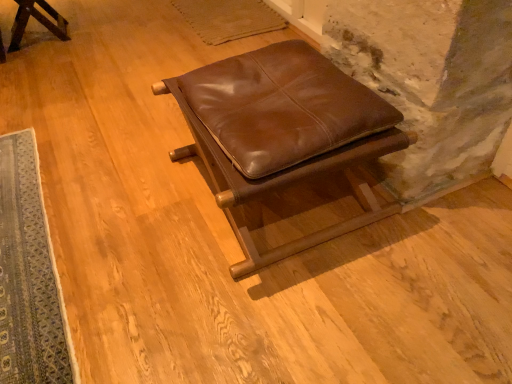
Question: Would you say blue woven rug at lower left is a long distance from brown leather ottoman at center, which ranks as the 2th furniture in back-to-front order?

Choices:
 (A) no
 (B) yes

Answer: (A)

Question: Is blue woven rug at lower left smaller than brown leather ottoman at center, arranged as the second furniture when viewed from the left?

Choices:
 (A) no
 (B) yes

Answer: (B)

Question: Can you confirm if blue woven rug at lower left is bigger than brown leather ottoman at center, which appears as the first furniture when viewed from the front?

Choices:
 (A) yes
 (B) no

Answer: (B)

Question: Is blue woven rug at lower left in contact with brown leather ottoman at center, which is the first furniture in right-to-left order?

Choices:
 (A) yes
 (B) no

Answer: (B)

Question: Considering the relative sizes of blue woven rug at lower left and brown leather ottoman at center, which appears as the first furniture when viewed from the front, in the image provided, is blue woven rug at lower left taller than brown leather ottoman at center, which appears as the first furniture when viewed from the front,?

Choices:
 (A) no
 (B) yes

Answer: (A)

Question: In the image, is brown leather ottoman at center, which is the first furniture in right-to-left order, positioned in front of or behind blue woven rug at lower left?

Choices:
 (A) front
 (B) behind

Answer: (A)

Question: Is brown leather ottoman at center, which is the first furniture in right-to-left order, inside or outside of blue woven rug at lower left?

Choices:
 (A) outside
 (B) inside

Answer: (A)

Question: Is brown leather ottoman at center, which ranks as the 2th furniture in back-to-front order, wider or thinner than blue woven rug at lower left?

Choices:
 (A) wide
 (B) thin

Answer: (B)

Question: From a real-world perspective, is brown leather ottoman at center, which ranks as the first furniture in bottom-to-top order, above or below blue woven rug at lower left?

Choices:
 (A) above
 (B) below

Answer: (A)

Question: Is point (203, 69) closer or farther from the camera than point (4, 54)?

Choices:
 (A) closer
 (B) farther

Answer: (A)

Question: Is brown leather ottoman at center, which ranks as the 2th furniture in back-to-front order, situated inside matte brown leather stool at upper left, the first furniture when ordered from top to bottom, or outside?

Choices:
 (A) inside
 (B) outside

Answer: (B)

Question: Looking at the image, does brown leather ottoman at center, which is the first furniture in right-to-left order, seem bigger or smaller compared to matte brown leather stool at upper left, marked as the second furniture in a front-to-back arrangement?

Choices:
 (A) small
 (B) big

Answer: (B)

Question: From a real-world perspective, is brown leather ottoman at center, arranged as the second furniture when viewed from the left, physically located above or below matte brown leather stool at upper left, the 1th furniture viewed from the left?

Choices:
 (A) below
 (B) above

Answer: (B)

Question: Based on their positions, is matte brown leather stool at upper left, the 1th furniture viewed from the left, located to the left or right of brown leather ottoman at center, the 2th furniture from the top?

Choices:
 (A) left
 (B) right

Answer: (A)

Question: From a real-world perspective, relative to brown leather ottoman at center, the 2th furniture from the top, is matte brown leather stool at upper left, the 1th furniture viewed from the left, vertically above or below?

Choices:
 (A) above
 (B) below

Answer: (B)